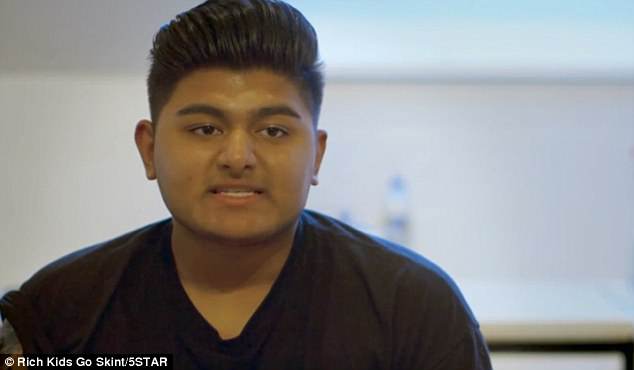
Locate an element on the screen. The width and height of the screenshot is (634, 370). white board is located at coordinates (534, 192).